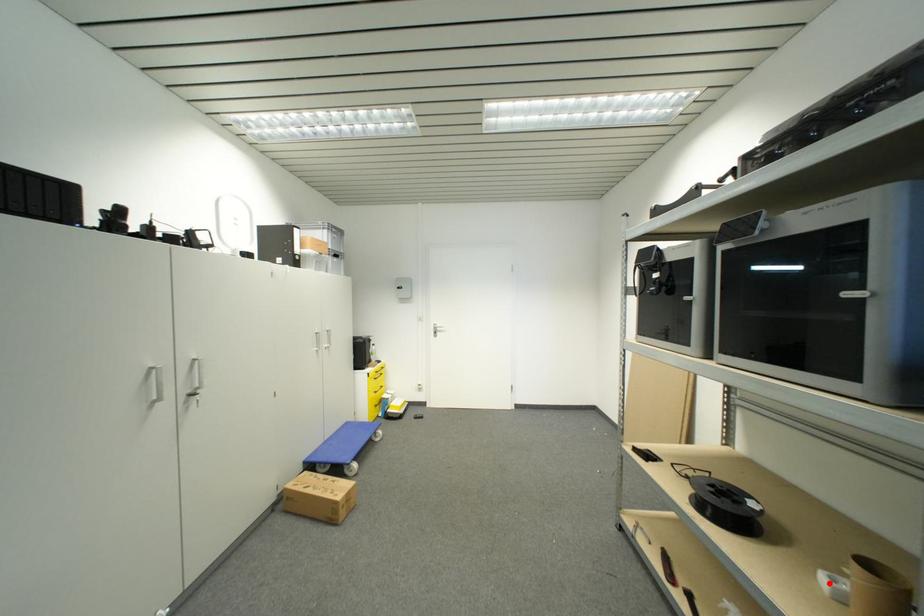
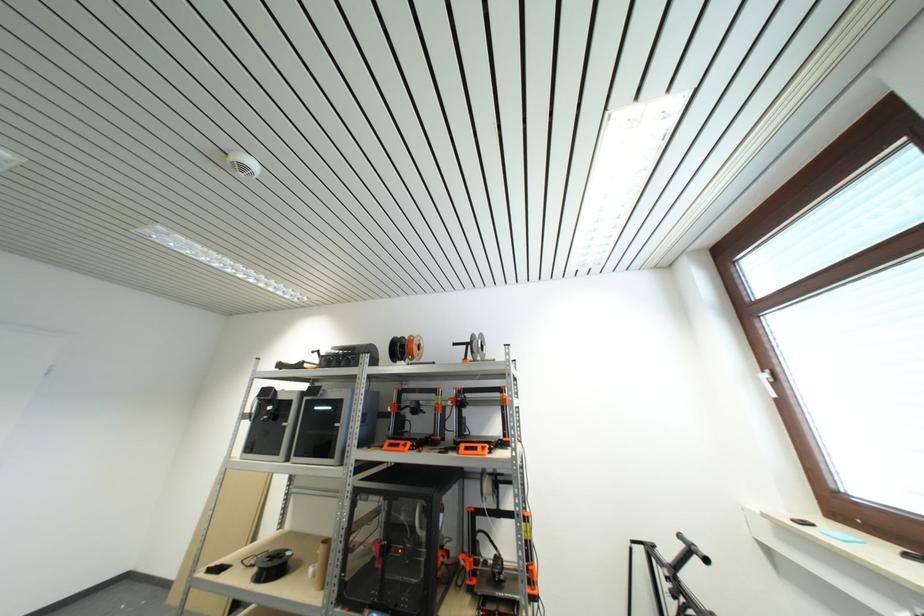
Question: I am providing you with two images of the same scene from different viewpoints. A red point is shown in image1. For the corresponding object point in image2, is it positioned nearer or farther from the camera?

Choices:
 (A) Nearer
 (B) Farther

Answer: (A)